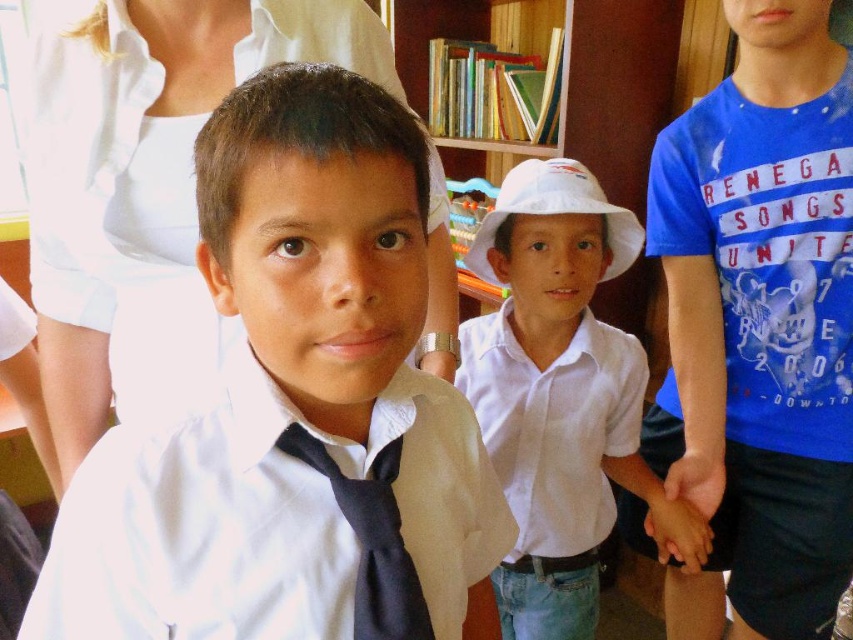
Question: Which object is farther from the camera taking this photo?

Choices:
 (A) blue cotton t-shirt at right
 (B) white cotton shirt at center
 (C) black satin tie at center
 (D) white matte shirt at center

Answer: (A)

Question: Which object is farther from the camera taking this photo?

Choices:
 (A) black satin tie at center
 (B) white matte shirt at center

Answer: (A)

Question: Is white matte shirt at center positioned at the back of black satin tie at center?

Choices:
 (A) no
 (B) yes

Answer: (A)

Question: Can you confirm if white matte shirt at center is smaller than blue cotton t-shirt at right?

Choices:
 (A) yes
 (B) no

Answer: (A)

Question: Which point is farther from the camera taking this photo?

Choices:
 (A) (403, 625)
 (B) (276, 376)
 (C) (566, 196)
 (D) (769, 608)

Answer: (D)

Question: Is white matte shirt at center to the left of white cotton shirt at center from the viewer's perspective?

Choices:
 (A) yes
 (B) no

Answer: (A)